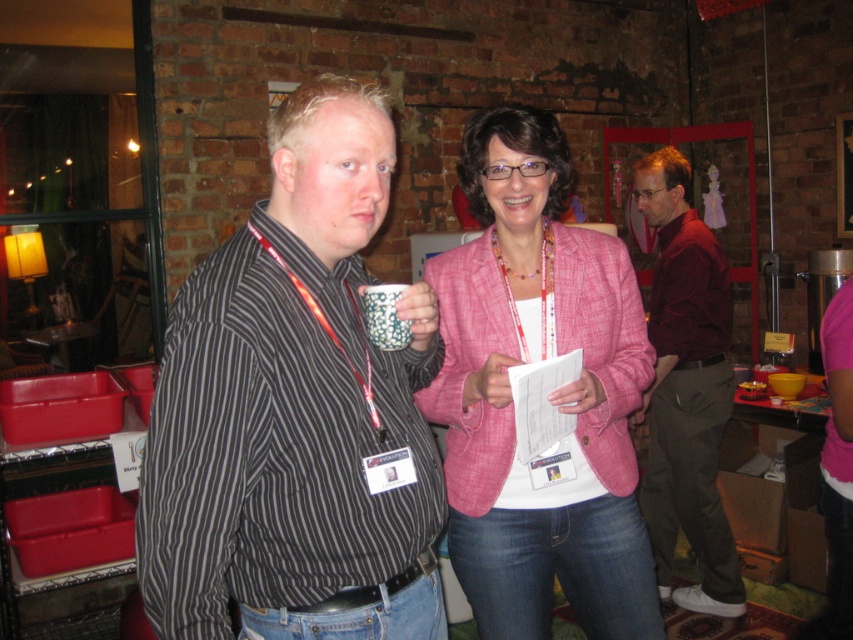
Is point (529, 289) farther from viewer compared to point (717, 516)?

No, (529, 289) is in front of (717, 516).

Who is taller, pink textured blazer at center or maroon corduroy shirt at right?

maroon corduroy shirt at right

Is point (589, 513) in front of point (714, 515)?

Yes.

Locate an element on the screen. pink textured blazer at center is located at coordinates (550, 396).

Can you confirm if black striped shirt at center is thinner than maroon corduroy shirt at right?

In fact, black striped shirt at center might be wider than maroon corduroy shirt at right.

Between black striped shirt at center and maroon corduroy shirt at right, which one appears on the left side from the viewer's perspective?

black striped shirt at center is more to the left.

Which is in front, point (444, 637) or point (689, 422)?

Point (444, 637) is in front.

Where is `black striped shirt at center`? Image resolution: width=853 pixels, height=640 pixels. black striped shirt at center is located at coordinates (294, 410).

Is black striped shirt at center taller than pink textured blazer at center?

In fact, black striped shirt at center may be shorter than pink textured blazer at center.

The height and width of the screenshot is (640, 853). What do you see at coordinates (294, 410) in the screenshot?
I see `black striped shirt at center` at bounding box center [294, 410].

Is point (343, 497) positioned after point (589, 465)?

No, it is in front of (589, 465).

Where is `black striped shirt at center`? black striped shirt at center is located at coordinates (294, 410).